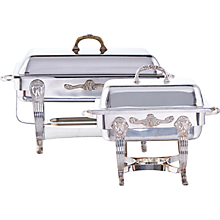
Where is `large chafing dish handle to lid`? Image resolution: width=220 pixels, height=220 pixels. large chafing dish handle to lid is located at coordinates pyautogui.click(x=86, y=36).